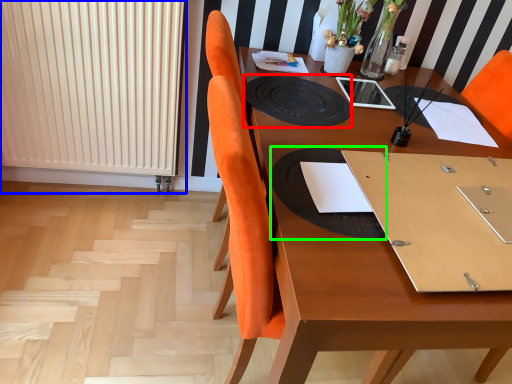
Question: Which object is the closest to the mat (highlighted by a red box)? Choose among these: radiator (highlighted by a blue box) or place mat (highlighted by a green box).

Choices:
 (A) radiator
 (B) place mat

Answer: (B)